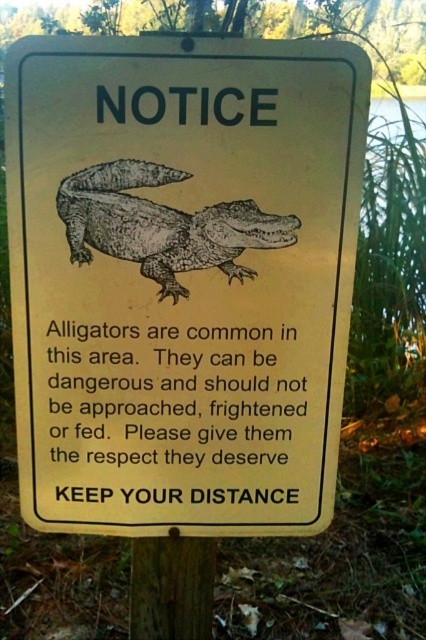
You are a park ranger who needs to ensure visitor safety. You see a brown textured alligator at center and a brown wood pole at center. Which object is wider? Please answer based on the description provided.

The brown textured alligator at center might be wider than brown wood pole at center.

You are a park ranger who needs to install a new sign. The sign must be placed on a pole so that the sign is visible to visitors approaching from all directions. Given that the yellow paper sign at center is above the brown wood pole at center, is the current placement suitable for visibility?

The yellow paper sign at center is located above the brown wood pole at center, which means it is placed high enough to be seen from all directions, making the current placement suitable for visibility.